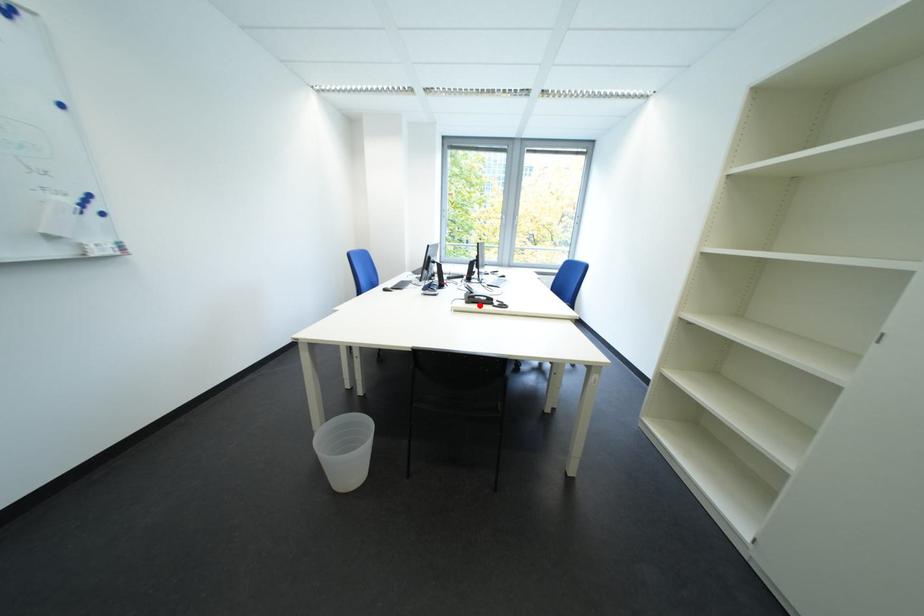
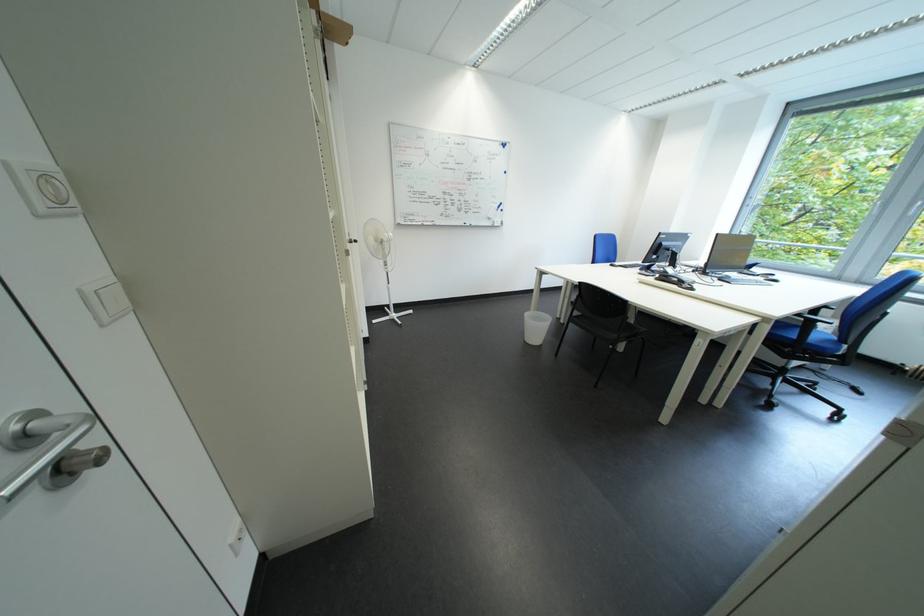
Locate, in the second image, the point that corresponds to the highlighted location in the first image.

(669, 282)